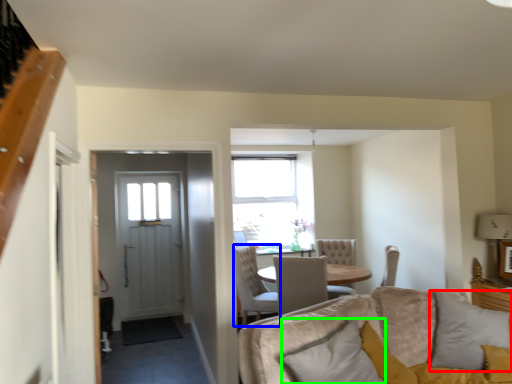
Question: Which is nearer to the pillow (highlighted by a red box)? chair (highlighted by a blue box) or pillow (highlighted by a green box).

Choices:
 (A) chair
 (B) pillow

Answer: (B)